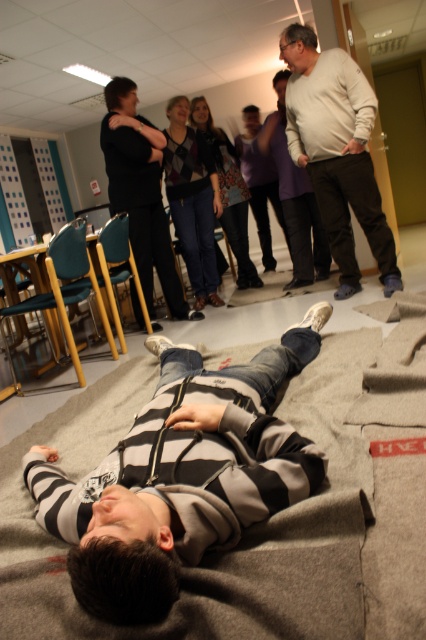
Question: Does gray woolen blanket at lower center have a greater width compared to light beige pants at center?

Choices:
 (A) no
 (B) yes

Answer: (B)

Question: Can you confirm if gray woolen blanket at lower center is positioned to the right of light gray sweater at upper center?

Choices:
 (A) no
 (B) yes

Answer: (A)

Question: Which point is closer to the camera?

Choices:
 (A) (146, 296)
 (B) (348, 280)
 (C) (65, 451)

Answer: (C)

Question: Which object is the farthest from the light gray sweater at upper center?

Choices:
 (A) light beige pants at center
 (B) gray woolen blanket at lower center
 (C) matte black shirt at center

Answer: (B)

Question: Does gray woolen blanket at lower center lie behind matte black shirt at center?

Choices:
 (A) yes
 (B) no

Answer: (B)

Question: Which point is closer to the camera?

Choices:
 (A) (340, 120)
 (B) (299, 564)
 (C) (123, 161)

Answer: (B)